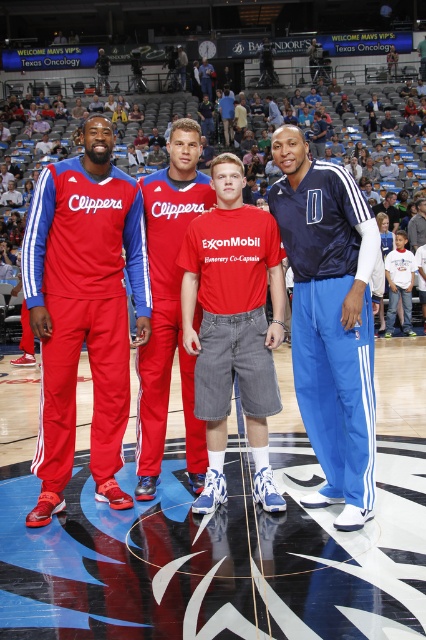
Question: Is red cotton t-shirt at center wider than red matte track pants at center?

Choices:
 (A) yes
 (B) no

Answer: (A)

Question: Considering the relative positions of matte red tracksuit at center and matte red tracksuit at left in the image provided, where is matte red tracksuit at center located with respect to matte red tracksuit at left?

Choices:
 (A) right
 (B) left

Answer: (A)

Question: Among these objects, which one is nearest to the camera?

Choices:
 (A) matte red tracksuit at left
 (B) matte red tracksuit at center
 (C) red cotton t-shirt at center

Answer: (B)

Question: From the image, what is the correct spatial relationship of matte red tracksuit at left in relation to red matte track pants at center?

Choices:
 (A) right
 (B) left

Answer: (B)

Question: Which point is farther from the camera taking this photo?

Choices:
 (A) (66, 637)
 (B) (227, 355)
 (C) (273, 508)

Answer: (B)

Question: Which of the following is the closest to the observer?

Choices:
 (A) matte red tracksuit at center
 (B) navy blue jersey at center
 (C) red matte track pants at center

Answer: (A)